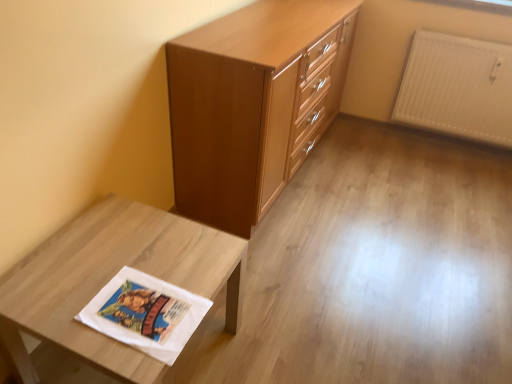
Question: From a real-world perspective, is white textured radiator at upper right located beneath matte wood chest of drawers at center?

Choices:
 (A) yes
 (B) no

Answer: (A)

Question: Is white textured radiator at upper right taller than matte wood chest of drawers at center?

Choices:
 (A) no
 (B) yes

Answer: (A)

Question: From the image's perspective, is white textured radiator at upper right located above matte wood chest of drawers at center?

Choices:
 (A) no
 (B) yes

Answer: (B)

Question: Is white textured radiator at upper right not close to matte wood chest of drawers at center?

Choices:
 (A) yes
 (B) no

Answer: (A)

Question: Considering the relative sizes of white textured radiator at upper right and matte wood chest of drawers at center in the image provided, is white textured radiator at upper right thinner than matte wood chest of drawers at center?

Choices:
 (A) yes
 (B) no

Answer: (A)

Question: Does white textured radiator at upper right appear on the right side of matte wood chest of drawers at center?

Choices:
 (A) no
 (B) yes

Answer: (B)

Question: From the image's perspective, is matte wood chest of drawers at center located above white textured radiator at upper right?

Choices:
 (A) yes
 (B) no

Answer: (B)

Question: From a real-world perspective, does matte wood chest of drawers at center stand above white textured radiator at upper right?

Choices:
 (A) no
 (B) yes

Answer: (B)

Question: Considering the relative sizes of matte wood chest of drawers at center and white textured radiator at upper right in the image provided, is matte wood chest of drawers at center bigger than white textured radiator at upper right?

Choices:
 (A) no
 (B) yes

Answer: (B)

Question: Does matte wood chest of drawers at center have a greater height compared to white textured radiator at upper right?

Choices:
 (A) yes
 (B) no

Answer: (A)

Question: Is matte wood chest of drawers at center touching white textured radiator at upper right?

Choices:
 (A) yes
 (B) no

Answer: (B)

Question: Considering the relative positions of matte wood chest of drawers at center and white textured radiator at upper right in the image provided, is matte wood chest of drawers at center to the right of white textured radiator at upper right from the viewer's perspective?

Choices:
 (A) yes
 (B) no

Answer: (B)

Question: Is white matte fabric at lower left smaller than white textured radiator at upper right?

Choices:
 (A) no
 (B) yes

Answer: (A)